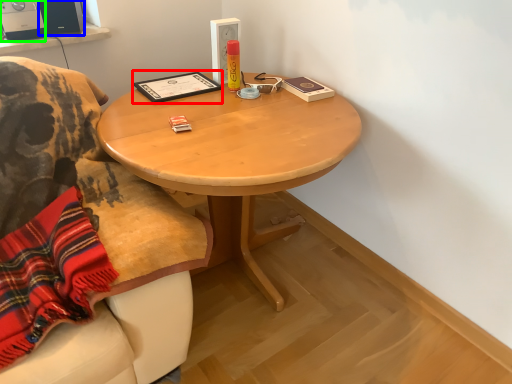
Question: Which object is positioned farthest from book (highlighted by a red box)? Select from loudspeaker (highlighted by a blue box) and loudspeaker (highlighted by a green box).

Choices:
 (A) loudspeaker
 (B) loudspeaker

Answer: (B)